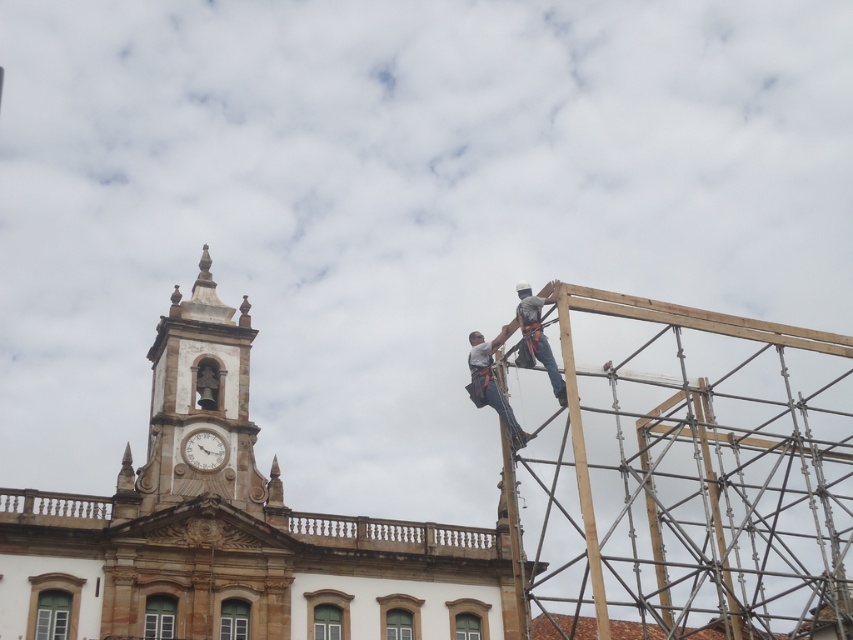
Between wooden scaffolding at upper right and white glossy clock at upper center, which one has more height?

wooden scaffolding at upper right is taller.

Does wooden scaffolding at upper right lie in front of white glossy clock at upper center?

Yes, it is in front of white glossy clock at upper center.

You are a GUI agent. You are given a task and a screenshot of the screen. Output one action in this format:
    pyautogui.click(x=<x>, y=<y>)
    Task: Click on the wooden scaffolding at upper right
    The height and width of the screenshot is (640, 853).
    Given the screenshot: What is the action you would take?
    pyautogui.click(x=682, y=476)

Between white stone clock tower at upper left and matte gray harness at upper right, which one is positioned lower?

white stone clock tower at upper left

Who is more distant from viewer, [241,365] or [474,355]?

Positioned behind is point [241,365].

Describe the element at coordinates (201, 403) in the screenshot. The height and width of the screenshot is (640, 853). I see `white stone clock tower at upper left` at that location.

This screenshot has height=640, width=853. Find the location of `white stone clock tower at upper left`. white stone clock tower at upper left is located at coordinates (201, 403).

Can you confirm if wooden scaffolding at upper right is taller than white stone clock tower at upper left?

Correct, wooden scaffolding at upper right is much taller as white stone clock tower at upper left.

Does wooden scaffolding at upper right have a lesser width compared to white stone clock tower at upper left?

No, wooden scaffolding at upper right is not thinner than white stone clock tower at upper left.

Where is `wooden scaffolding at upper right`? wooden scaffolding at upper right is located at coordinates (682, 476).